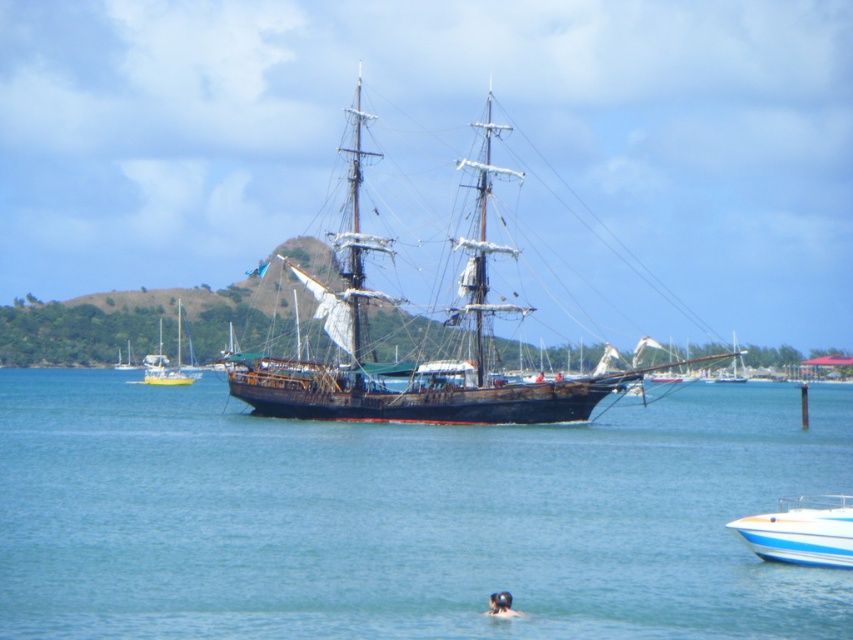
Does point (808, 516) come in front of point (161, 339)?

That is True.

Who is more forward, [848,538] or [181,376]?

Positioned in front is point [848,538].

Describe the element at coordinates (801, 531) in the screenshot. This screenshot has height=640, width=853. I see `blue glossy speedboat at lower right` at that location.

Identify the location of blue glossy speedboat at lower right. This screenshot has height=640, width=853. (801, 531).

Between blue water at center and yellow plastic sailboat at left, which one is positioned higher?

yellow plastic sailboat at left is higher up.

Can you confirm if blue water at center is thinner than yellow plastic sailboat at left?

Incorrect, blue water at center's width is not less than yellow plastic sailboat at left's.

Does point (285, 524) come behind point (154, 378)?

No, (285, 524) is in front of (154, 378).

Where is `blue water at center`? Image resolution: width=853 pixels, height=640 pixels. blue water at center is located at coordinates (405, 516).

Is point (833, 545) behind point (500, 614)?

Yes, it is.

Between point (831, 557) and point (505, 608), which one is positioned behind?

The point (831, 557) is more distant.

Image resolution: width=853 pixels, height=640 pixels. I want to click on blue glossy speedboat at lower right, so click(801, 531).